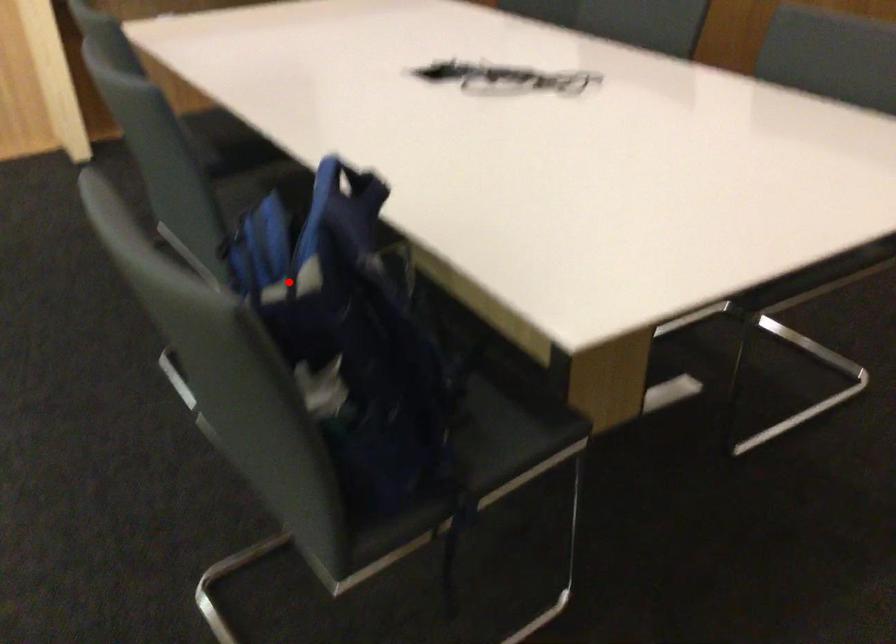
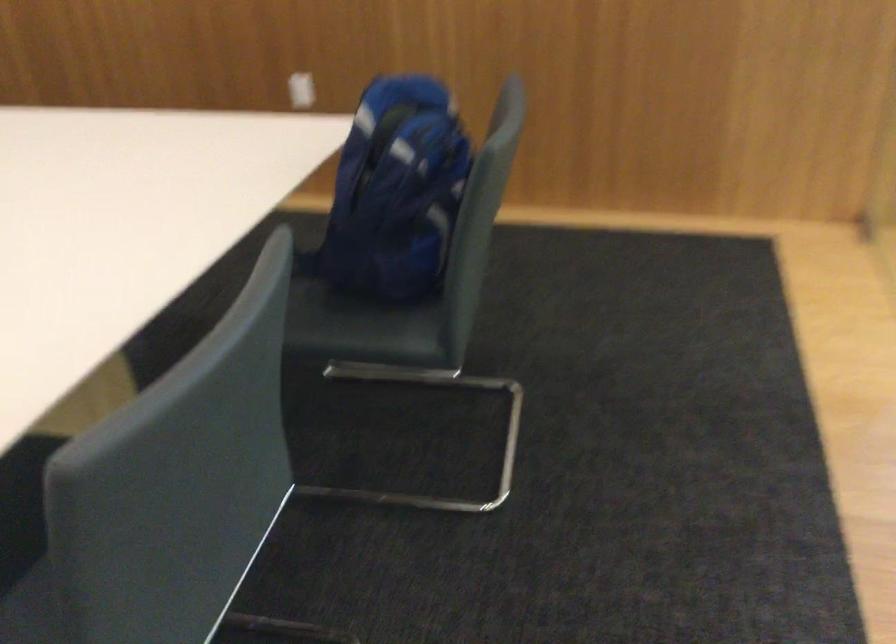
Question: I am providing you with two images of the same scene from different viewpoints. Given a red point in image1, look at the same physical point in image2. Is it:

Choices:
 (A) Closer to the viewpoint
 (B) Farther from the viewpoint

Answer: (B)